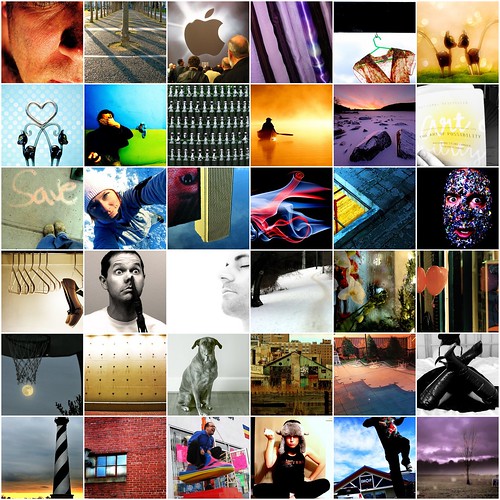
You are a GUI agent. You are given a task and a screenshot of the screen. Output one action in this format:
    pyautogui.click(x=<x>, y=<y>)
    Task: Click on the pictures in bottom row
    
    Given the screenshot: What is the action you would take?
    pyautogui.click(x=61, y=443), pyautogui.click(x=108, y=469), pyautogui.click(x=216, y=452), pyautogui.click(x=284, y=450), pyautogui.click(x=368, y=455), pyautogui.click(x=482, y=454)